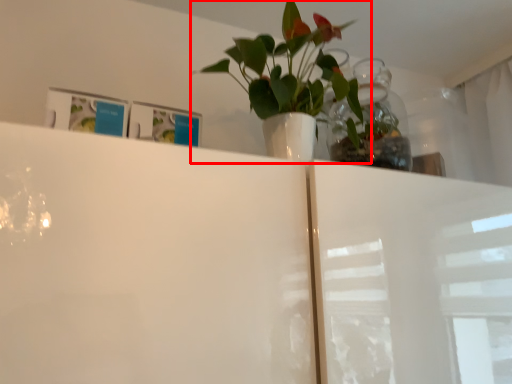
Question: From the image's perspective, what is the correct spatial positioning of houseplant (annotated by the red box) in reference to glass vase?

Choices:
 (A) below
 (B) above

Answer: (B)